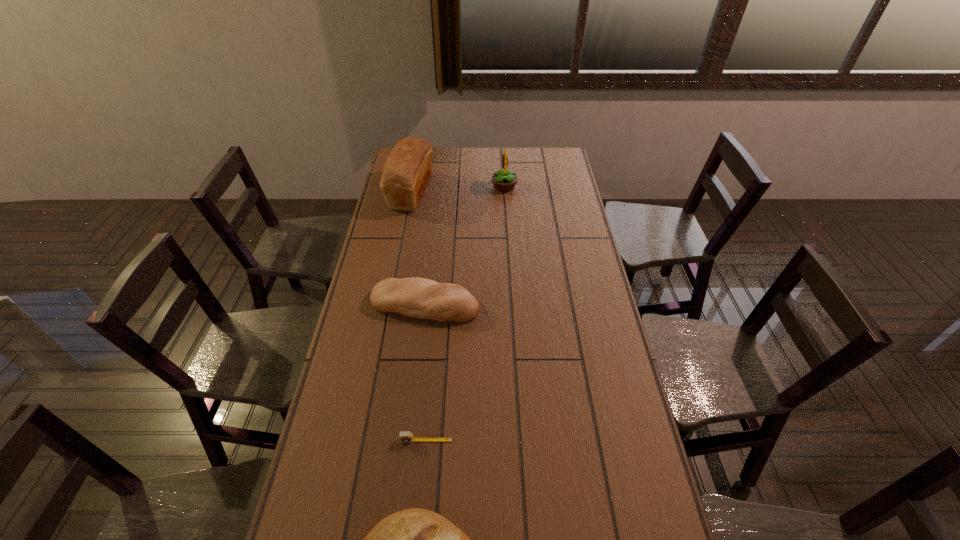
Locate an element on the screen. Image resolution: width=960 pixels, height=540 pixels. free space located 0.160m on the front of the third nearest object is located at coordinates (418, 365).

Locate an element on the screen. This screenshot has height=540, width=960. free space located at the front of the shortest object with the tape extended is located at coordinates (423, 469).

Where is `object present at the far edge`? The height and width of the screenshot is (540, 960). object present at the far edge is located at coordinates (408, 167).

This screenshot has height=540, width=960. In order to click on object situated at the far left corner in this screenshot , I will do `click(408, 167)`.

The width and height of the screenshot is (960, 540). I want to click on vacant space at the far edge, so click(501, 152).

You are a GUI agent. You are given a task and a screenshot of the screen. Output one action in this format:
    pyautogui.click(x=<x>, y=<y>)
    Task: Click on the vacant space at the left edge of the desktop
    
    Given the screenshot: What is the action you would take?
    pyautogui.click(x=377, y=449)

At what (x,y) coordinates should I click in order to perform the action: click on vacant point at the right edge. Please return your answer as a coordinate pair (x, y). Looking at the image, I should click on coord(560,218).

You are a GUI agent. You are given a task and a screenshot of the screen. Output one action in this format:
    pyautogui.click(x=<x>, y=<y>)
    Task: Click on the empty space between the tallest bread and the rightmost object
    Image resolution: width=960 pixels, height=540 pixels.
    Given the screenshot: What is the action you would take?
    (458, 189)

The image size is (960, 540). Identify the location of vacant area that lies between the third farthest object and the tallest bread. (418, 248).

Where is `empty location between the tallest bread and the second farthest bread`? The image size is (960, 540). empty location between the tallest bread and the second farthest bread is located at coordinates (418, 248).